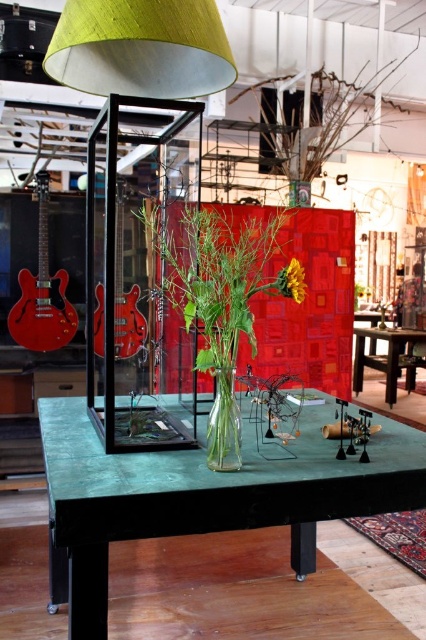
Question: Does green fabric lampshade at center appear over yellow matte sunflower at center?

Choices:
 (A) yes
 (B) no

Answer: (A)

Question: Which point is farther to the camera?

Choices:
 (A) green matte table at center
 (B) green matte table at lower right

Answer: (B)

Question: Can you confirm if green fabric lampshade at center is positioned above yellow matte sunflower at center?

Choices:
 (A) no
 (B) yes

Answer: (B)

Question: Which object is farther from the camera taking this photo?

Choices:
 (A) green matte table at lower right
 (B) yellow matte sunflower at center

Answer: (A)

Question: Which object appears closest to the camera in this image?

Choices:
 (A) green matte table at center
 (B) clear glass vase at center
 (C) green fabric lampshade at center

Answer: (A)

Question: Considering the relative positions of green matte table at lower right and transparent glass vase at center in the image provided, where is green matte table at lower right located with respect to transparent glass vase at center?

Choices:
 (A) right
 (B) left

Answer: (A)